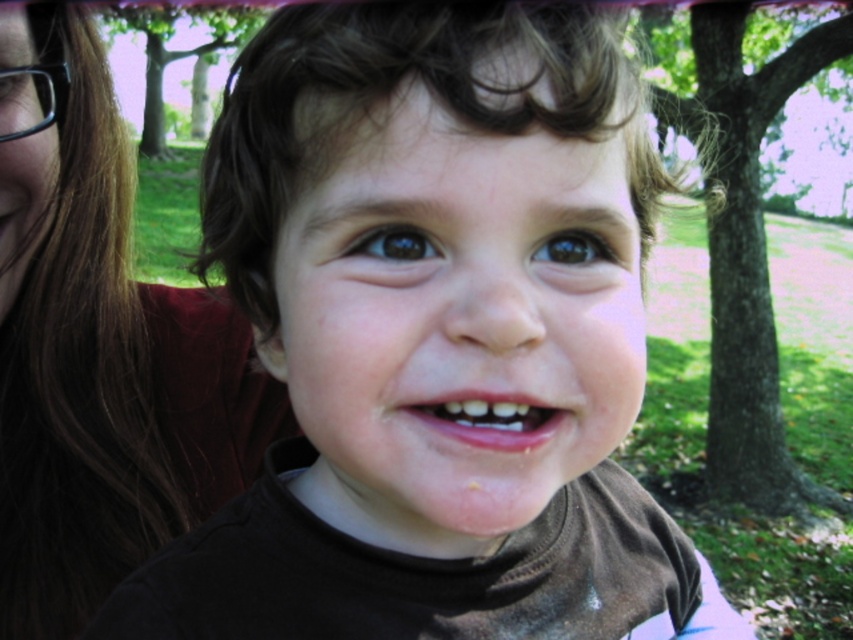
Question: Among these points, which one is nearest to the camera?

Choices:
 (A) (3, 218)
 (B) (26, 96)
 (C) (383, 241)

Answer: (C)

Question: Which point is closer to the camera taking this photo?

Choices:
 (A) (20, 19)
 (B) (473, 420)
 (C) (15, 67)

Answer: (B)

Question: Does smooth skin face at center appear on the right side of brown matte eye at upper left?

Choices:
 (A) yes
 (B) no

Answer: (A)

Question: Is brown matte eye at center closer to camera compared to brown matte eye at upper left?

Choices:
 (A) no
 (B) yes

Answer: (B)

Question: Which of the following is the closest to the observer?

Choices:
 (A) (573, 234)
 (B) (50, 22)
 (C) (3, 35)

Answer: (A)

Question: Can you confirm if brown hair at upper left is positioned to the right of brown matte eye at center?

Choices:
 (A) yes
 (B) no

Answer: (B)